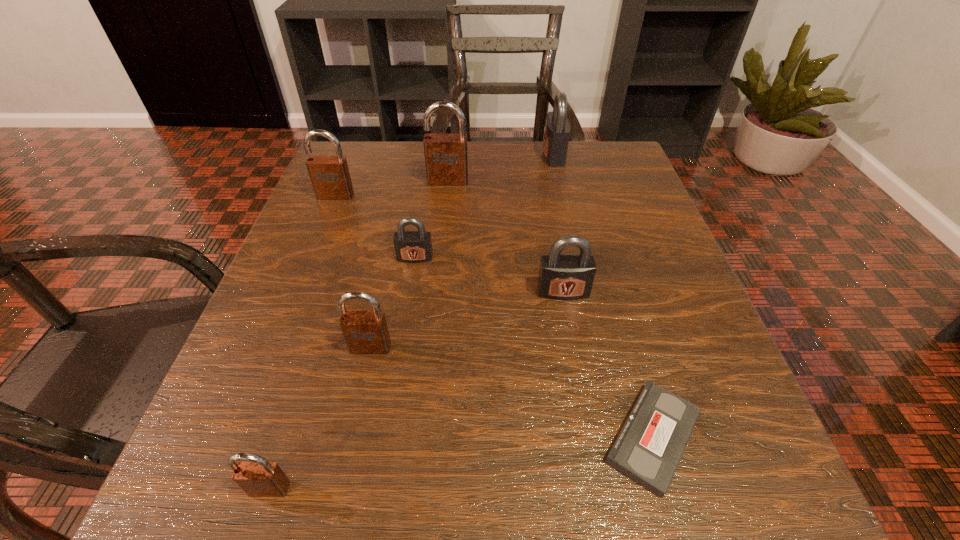
You are a GUI agent. You are given a task and a screenshot of the screen. Output one action in this format:
    pyautogui.click(x=<x>, y=<y>)
    Task: Click on the farthest brown padlock
    
    Given the screenshot: What is the action you would take?
    pyautogui.click(x=446, y=159)

The width and height of the screenshot is (960, 540). I want to click on the second farthest object, so click(x=446, y=159).

This screenshot has height=540, width=960. Find the location of `the farthest padlock`. the farthest padlock is located at coordinates (557, 131).

This screenshot has width=960, height=540. I want to click on the farthest gray padlock, so click(557, 131).

At what (x,y) coordinates should I click in order to perform the action: click on the fifth nearest padlock. Please return your answer as a coordinate pair (x, y). The width and height of the screenshot is (960, 540). Looking at the image, I should click on (330, 177).

Where is `the leftmost padlock`? The image size is (960, 540). the leftmost padlock is located at coordinates (330, 177).

Where is `the second nearest padlock`? This screenshot has width=960, height=540. the second nearest padlock is located at coordinates (365, 332).

At what (x,y) coordinates should I click in order to perform the action: click on the third nearest object. Please return your answer as a coordinate pair (x, y). The height and width of the screenshot is (540, 960). Looking at the image, I should click on (365, 332).

The image size is (960, 540). Find the location of `the third nearest padlock`. the third nearest padlock is located at coordinates (564, 277).

In order to click on the nearest gray padlock in this screenshot , I will do `click(564, 277)`.